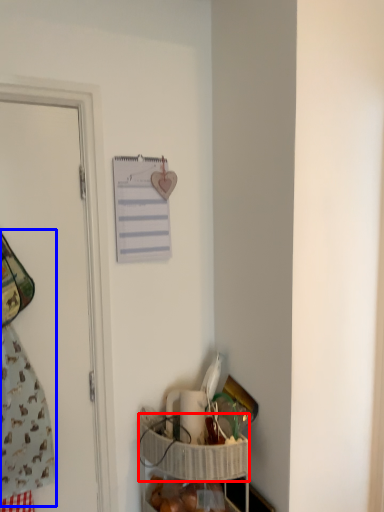
Question: Which of the following is the closest to the observer, basket (highlighted by a red box) or laundry (highlighted by a blue box)?

Choices:
 (A) basket
 (B) laundry

Answer: (B)